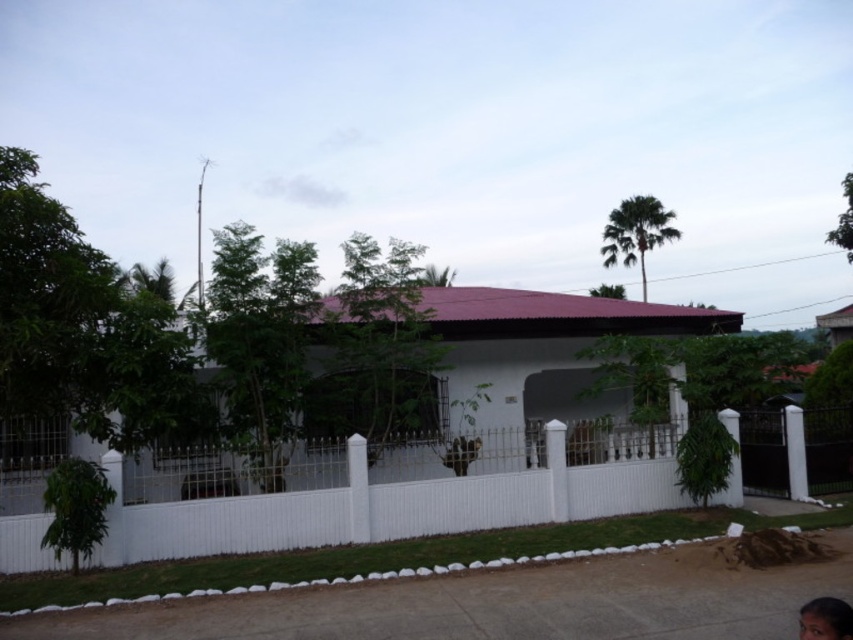
Question: In this image, where is white picket fence at center located relative to smooth skin face at lower right?

Choices:
 (A) left
 (B) right

Answer: (A)

Question: Does white picket fence at center appear on the right side of smooth skin face at lower right?

Choices:
 (A) no
 (B) yes

Answer: (A)

Question: Observing the image, what is the correct spatial positioning of white picket fence at center in reference to smooth skin face at lower right?

Choices:
 (A) right
 (B) left

Answer: (B)

Question: Among these points, which one is nearest to the camera?

Choices:
 (A) (445, 481)
 (B) (799, 630)

Answer: (B)

Question: Which of the following is the farthest from the observer?

Choices:
 (A) white picket fence at center
 (B) smooth skin face at lower right

Answer: (A)

Question: Which of the following is the farthest from the observer?

Choices:
 (A) smooth skin face at lower right
 (B) white picket fence at center

Answer: (B)